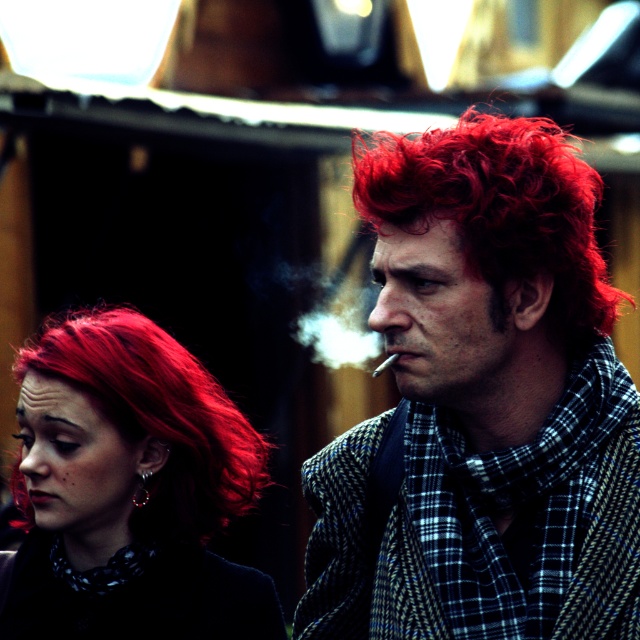
You are a photographer adjusting your camera settings to focus on the shiny red hair at center and the matte silver cigarette at center. Which object should you focus on first if you want to capture both clearly in the same frame?

The shiny red hair at center is in front of the matte silver cigarette at center, so you should focus on the shiny red hair at center first to ensure both are in focus since the cigarette is behind it.

You are a photographer standing at a certain distance from the two people with shiny red hair at center. You want to capture a clear photo of their faces without any blur. Considering the camera settings, what is the minimum distance you should maintain to ensure the photo is sharp?

The minimum distance you should maintain is 19.75 meters because the shiny red hair at center is 19.75 meters away from the camera, and this distance ensures the photo will be sharp without blur.

Based on the scene description, can you determine the location of the point with coordinates (342, 317) in relation to the white smoke at center?

The point with coordinates (342, 317) is located on the white smoke at center.